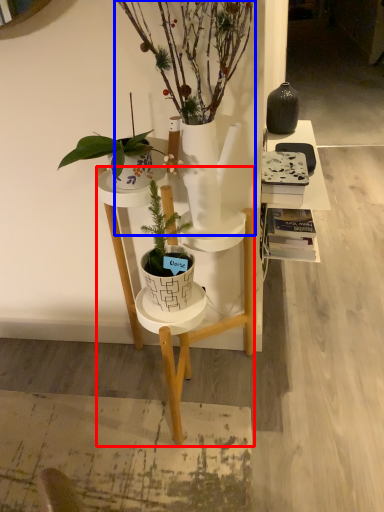
Question: Which object is closer to the camera taking this photo, desk (highlighted by a red box) or houseplant (highlighted by a blue box)?

Choices:
 (A) desk
 (B) houseplant

Answer: (B)